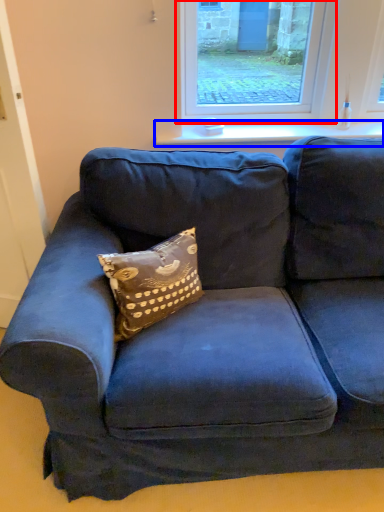
Question: Which object appears closest to the camera in this image, window (highlighted by a red box) or window sill (highlighted by a blue box)?

Choices:
 (A) window
 (B) window sill

Answer: (A)